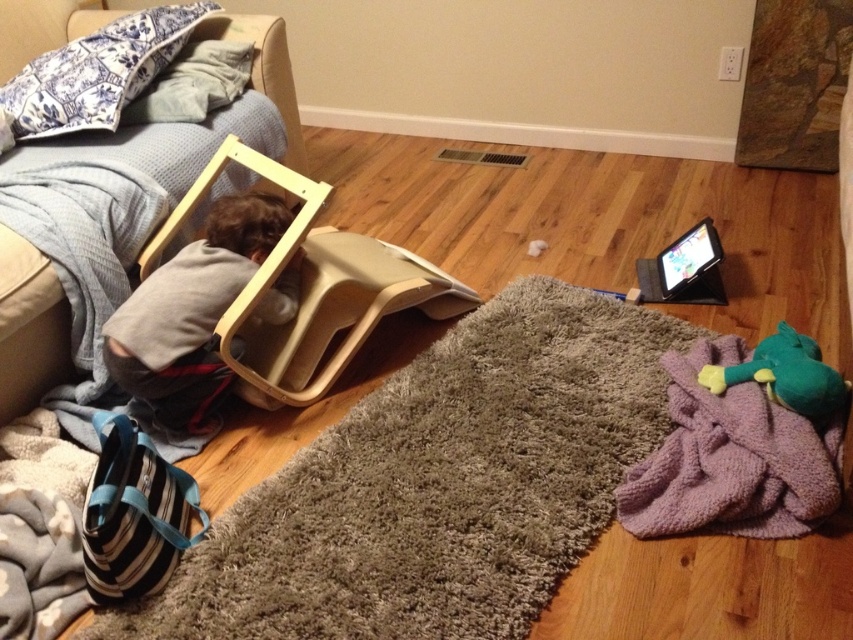
You are a parent organizing the living room and want to place the light brown fabric couch at left and the blue toile fabric pillow at upper left. Which object is narrower?

The light brown fabric couch at left is narrower than the blue toile fabric pillow at upper left according to the description.

From the picture: You are organizing the child play area and need to place a new toy box. The toy box must be placed to the left of the purple fuzzy blanket at lower right. Where should you position the toy box relative to the existing objects in the scene?

The purple fuzzy blanket at lower right is located at point (730,460). To place the toy box to the left of it, position the toy box to the left side of the purple fuzzy blanket at lower right.

You are organizing a small party in the child bedroom and need to arrange the light brown fabric couch at left and the blue toile fabric pillow at upper left. Since space is limited, which object should you move to free up more space?

The light brown fabric couch at left occupies less space than the blue toile fabric pillow at upper left, so moving the blue toile fabric pillow at upper left will free up more space.